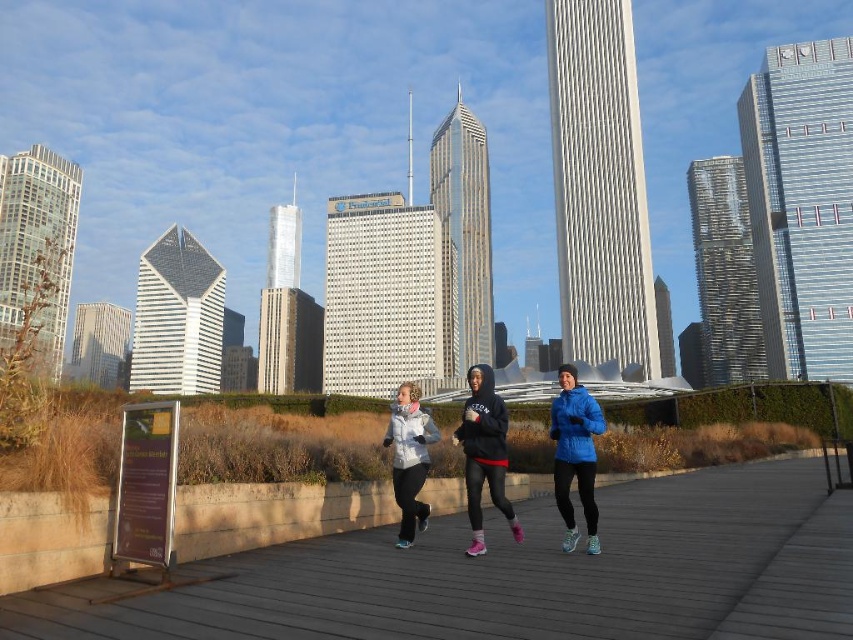
Can you confirm if black hoodie at center is smaller than matte white jacket at center?

Yes.

Identify the location of black hoodie at center. This screenshot has width=853, height=640. (485, 452).

Which is in front, point (332, 540) or point (486, 422)?

Point (486, 422)

Is wooden boardwalk at center closer to camera compared to black hoodie at center?

Yes, it is.

Does point (361, 620) come farther from viewer compared to point (482, 470)?

No, it is not.

The height and width of the screenshot is (640, 853). Identify the location of wooden boardwalk at center. (520, 576).

Is wooden boardwalk at center thinner than matte white jacket at center?

Incorrect, wooden boardwalk at center's width is not less than matte white jacket at center's.

Who is higher up, wooden boardwalk at center or matte white jacket at center?

matte white jacket at center is higher up.

Which is in front, point (846, 509) or point (419, 520)?

Point (846, 509) is more forward.

In order to click on wooden boardwalk at center in this screenshot , I will do `click(520, 576)`.